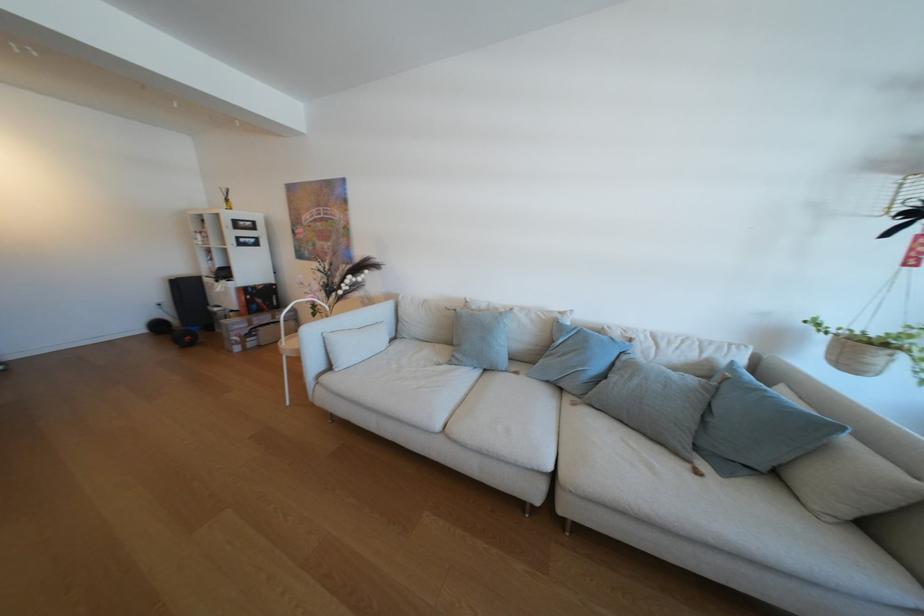
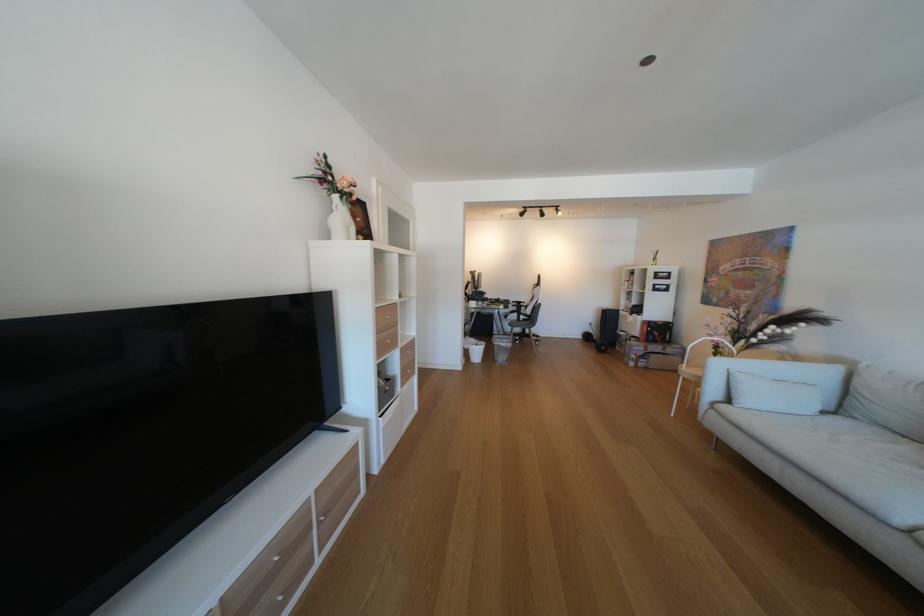
In the second image, find the point that corresponds to [324,367] in the first image.

(723, 392)